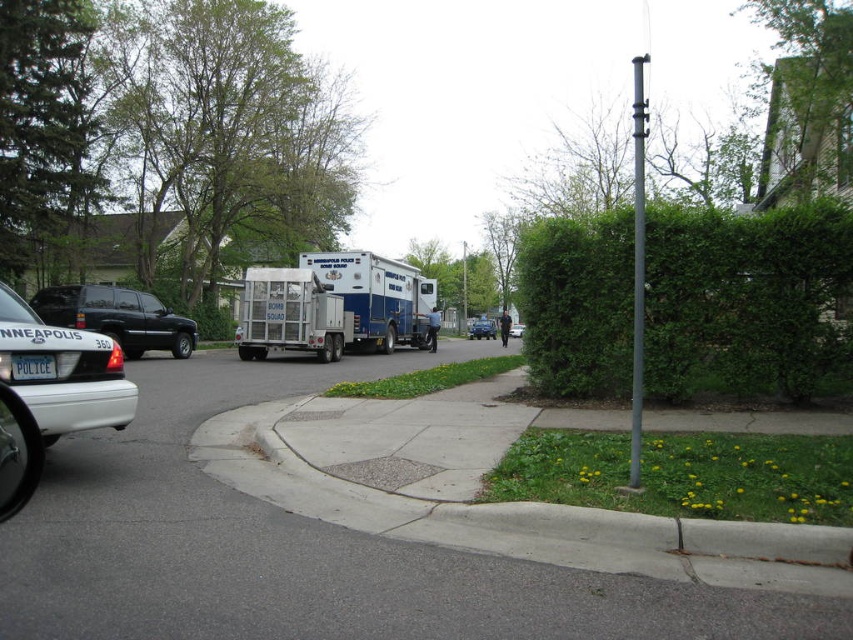
Question: Observing the image, what is the correct spatial positioning of gray asphalt pavement at center in reference to white matte police car at left?

Choices:
 (A) right
 (B) left

Answer: (A)

Question: Observing the image, what is the correct spatial positioning of blue metallic sedan at center in reference to white glossy sedan at center?

Choices:
 (A) above
 (B) below

Answer: (A)

Question: Which object appears farthest from the camera in this image?

Choices:
 (A) black matte suv at left
 (B) gray asphalt pavement at center
 (C) white plastic license plate at center

Answer: (A)

Question: Which point appears farthest from the camera in this image?

Choices:
 (A) (520, 326)
 (B) (18, 371)
 (C) (316, 294)
 (D) (42, 339)

Answer: (A)

Question: Does white plastic license plate at center lie in front of white glossy sedan at center?

Choices:
 (A) yes
 (B) no

Answer: (A)

Question: Which point is farther to the camera?

Choices:
 (A) white plastic license plate at center
 (B) white metallic truck at center

Answer: (B)